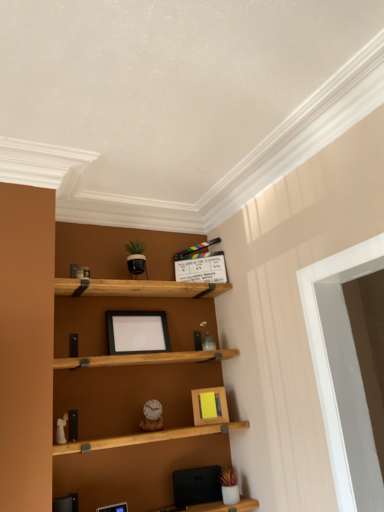
Question: Is white glossy door at right bigger or smaller than black matte picture frame at center, arranged as the first picture frame when viewed from the top?

Choices:
 (A) big
 (B) small

Answer: (A)

Question: Is white glossy door at right inside or outside of black matte picture frame at center, the third picture frame when ordered from bottom to top?

Choices:
 (A) outside
 (B) inside

Answer: (A)

Question: Based on their relative distances, which object is farther from the black matte picture frame at center, the third picture frame when ordered from bottom to top?

Choices:
 (A) wooden picture frame at center, the 3th picture frame from the right
 (B) white glossy door at right
 (C) wooden picture frame at center, which appears as the first picture frame when viewed from the right

Answer: (B)

Question: Which object is the farthest from the black matte picture frame at center, arranged as the first picture frame when viewed from the top?

Choices:
 (A) wooden picture frame at center, positioned as the 1th picture frame in front-to-back order
 (B) wooden picture frame at center, which appears as the third picture frame when viewed from the front
 (C) white glossy door at right

Answer: (C)